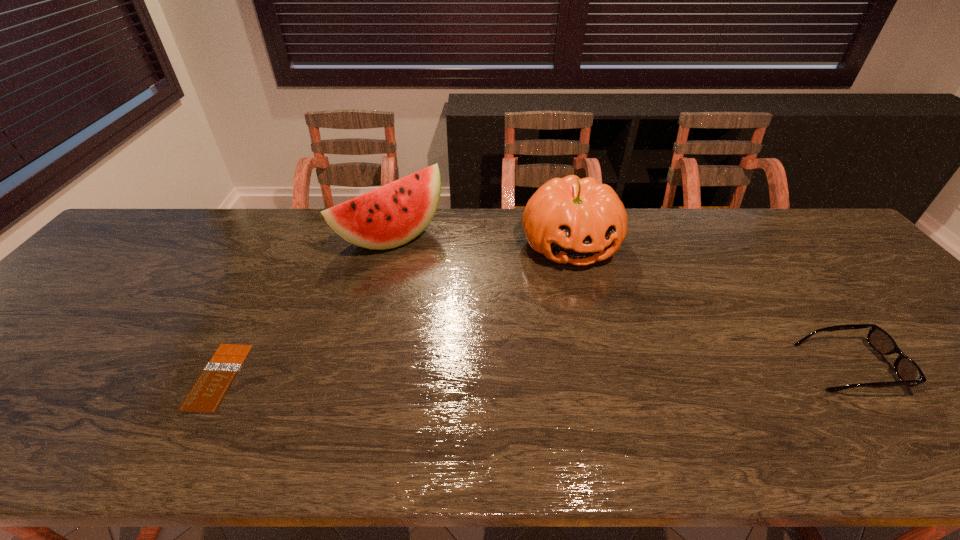
Where is `free space located 0.110m on the outer rind of the second object from left to right`? free space located 0.110m on the outer rind of the second object from left to right is located at coordinates tap(444, 274).

Find the location of a particular element. The image size is (960, 540). free space located 0.230m on the carved face of the second object from right to left is located at coordinates (610, 340).

At what (x,y) coordinates should I click in order to perform the action: click on vacant space located 0.250m on the carved face of the second object from right to left. Please return your answer as a coordinate pair (x, y). The height and width of the screenshot is (540, 960). Looking at the image, I should click on (612, 347).

You are a GUI agent. You are given a task and a screenshot of the screen. Output one action in this format:
    pyautogui.click(x=<x>, y=<y>)
    Task: Click on the vacant region located 0.340m on the carved face of the second object from right to left
    This screenshot has width=960, height=540.
    Given the screenshot: What is the action you would take?
    pyautogui.click(x=625, y=379)

Locate an element on the screen. This screenshot has width=960, height=540. watermelon located at the far edge is located at coordinates (392, 215).

Find the location of a particular element. pumpkin positioned at the far edge is located at coordinates (570, 220).

You are a GUI agent. You are given a task and a screenshot of the screen. Output one action in this format:
    pyautogui.click(x=<x>, y=<y>)
    Task: Click on the chocolate bar that is at the near edge
    Image resolution: width=960 pixels, height=540 pixels.
    Given the screenshot: What is the action you would take?
    pyautogui.click(x=206, y=395)

Identify the location of spectacles situated at the near edge. click(909, 373).

In the image, there is a desktop. Find the location of `free region at the far edge`. free region at the far edge is located at coordinates (249, 238).

In the image, there is a desktop. Identify the location of vacant space at the near edge. (664, 388).